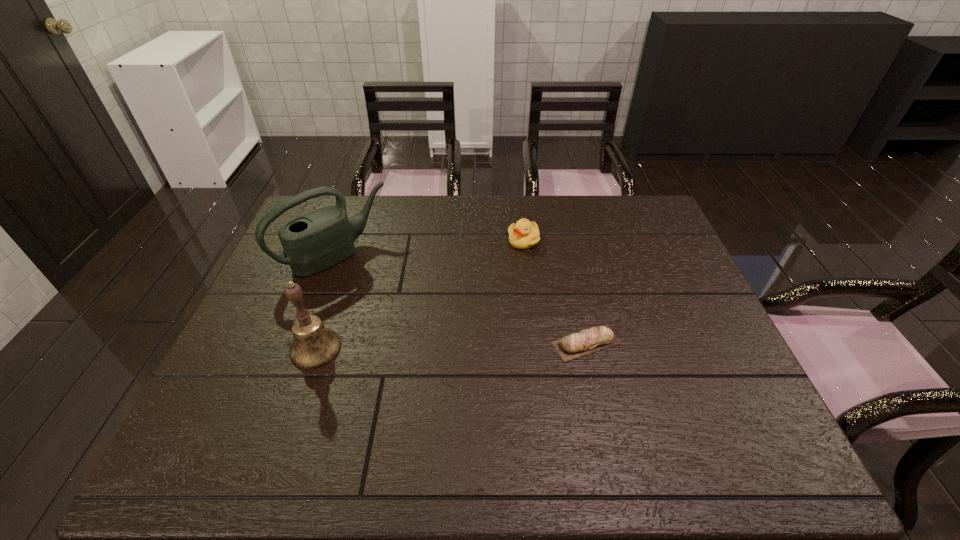
At what (x,y) coordinates should I click in order to perform the action: click on blank region between the bell and the pita bread. Please return your answer as a coordinate pair (x, y). Looking at the image, I should click on (451, 346).

The image size is (960, 540). I want to click on unoccupied position between the bell and the shortest object, so click(451, 346).

Where is `free space between the watering can and the bell`? Image resolution: width=960 pixels, height=540 pixels. free space between the watering can and the bell is located at coordinates (325, 301).

At what (x,y) coordinates should I click in order to perform the action: click on object that stands as the third closest to the bell. Please return your answer as a coordinate pair (x, y). Looking at the image, I should click on (524, 234).

Locate which object ranks in proximity to the watering can. Please provide its 2D coordinates. Your answer should be formatted as a tuple, i.e. [(x, y)], where the tuple contains the x and y coordinates of a point satisfying the conditions above.

[(314, 345)]